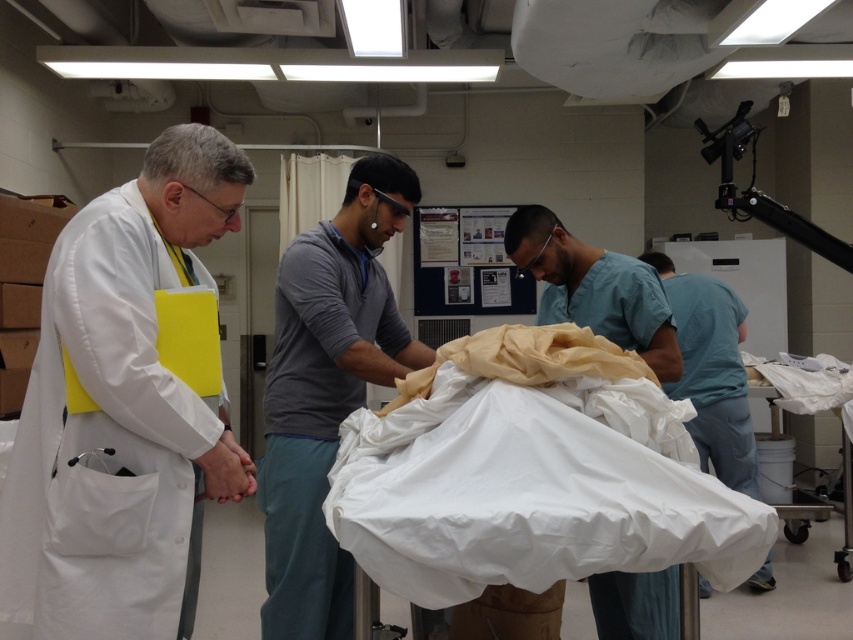
Can you confirm if white matte lab coat at left is shorter than blue scrubs at center?

No.

Does white matte lab coat at left come behind blue scrubs at center?

That is False.

What do you see at coordinates (125, 406) in the screenshot? I see `white matte lab coat at left` at bounding box center [125, 406].

The width and height of the screenshot is (853, 640). I want to click on white matte lab coat at left, so coord(125,406).

Who is more forward, (279, 371) or (703, 320)?

Point (279, 371) is more forward.

Who is more forward, (311, 400) or (727, 292)?

Positioned in front is point (311, 400).

Locate an element on the screen. The image size is (853, 640). gray cotton shirt at center is located at coordinates (328, 390).

Between point (547, 348) and point (703, 330), which one is positioned behind?

The point (703, 330) is behind.

Locate an element on the screen. Image resolution: width=853 pixels, height=640 pixels. white fabric at center is located at coordinates (532, 474).

This screenshot has width=853, height=640. What are the coordinates of `white fabric at center` in the screenshot? It's located at (532, 474).